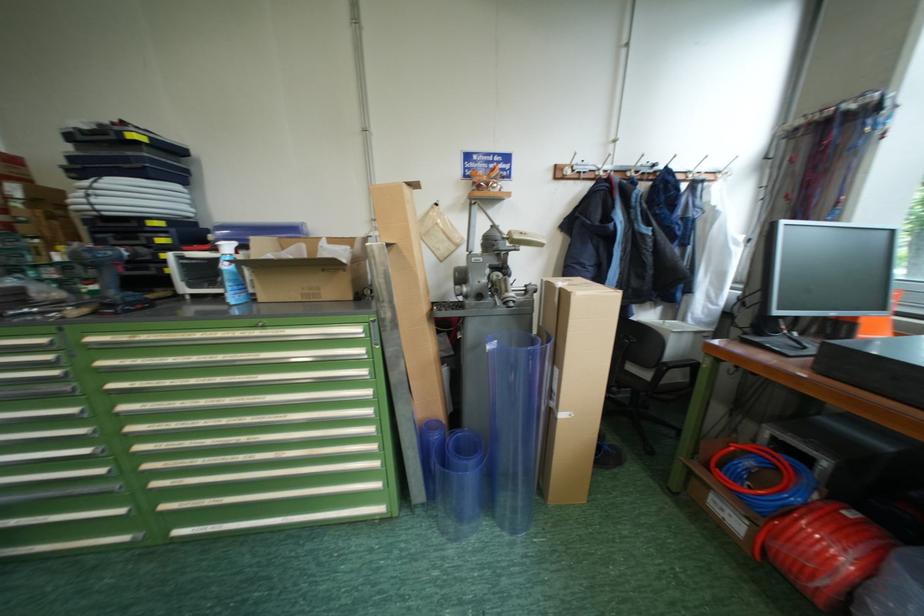
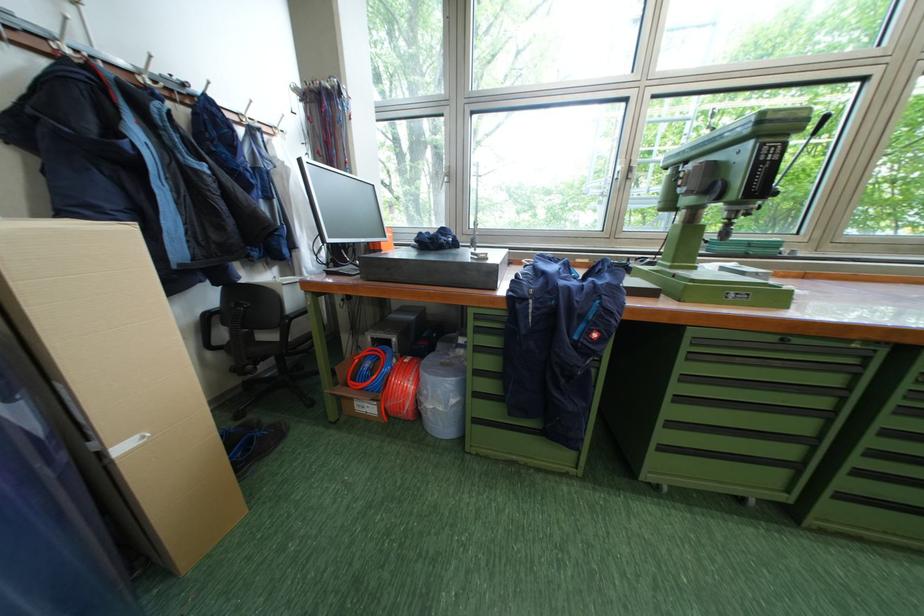
Question: The camera is either moving clockwise (left) or counter-clockwise (right) around the object. The first image is from the beginning of the video and the second image is from the end. Is the camera moving left or right when shooting the video?

Choices:
 (A) Left
 (B) Right

Answer: (A)